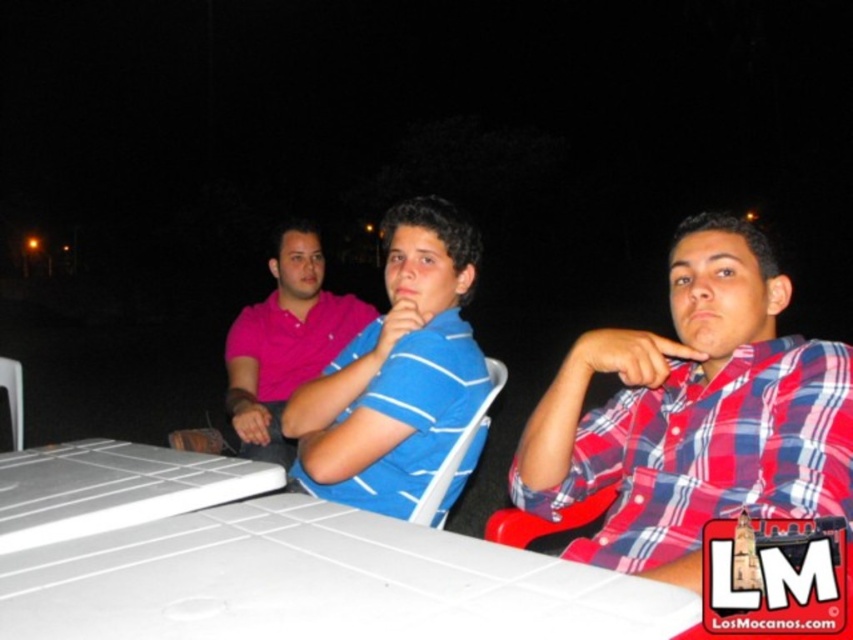
You are trying to place a new item on the table. The white plastic laptop at lower left and the pink cotton polo shirt at center are already there. If you want to place a rectangular box that is 15 cm wide, where should you put it?

The white plastic laptop at lower left might be wider than the pink cotton polo shirt at center, so placing the 15 cm wide box next to the pink cotton polo shirt at center would be more likely to fit since it has more space available.

In the nighttime scene with three people sitting at a white table, which object is positioned to the right of the other between the blue striped shirt at center and the pink cotton polo shirt at center?

The blue striped shirt at center is positioned to the right of the pink cotton polo shirt at center.